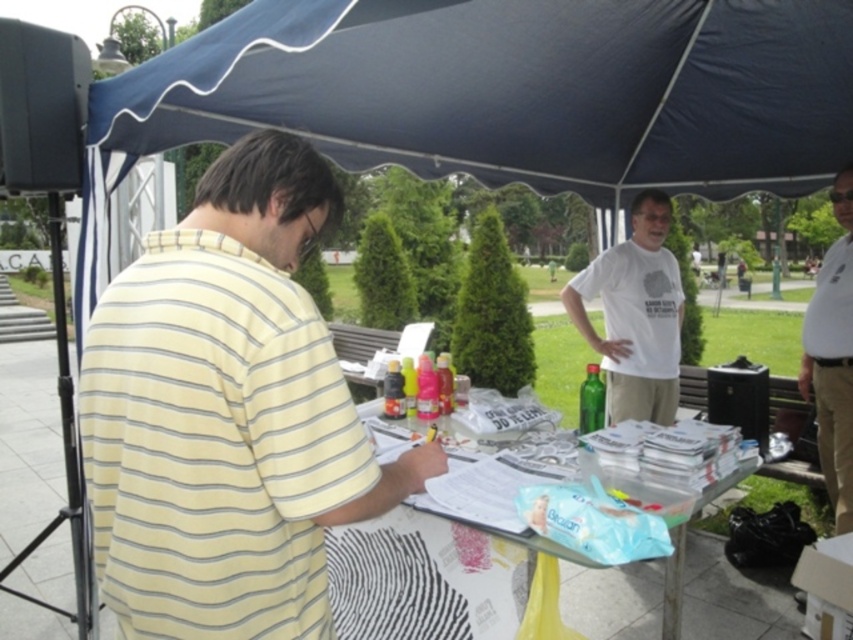
Find the location of a particular element. white plastic table at center is located at coordinates (432, 577).

Is white plastic table at center further to camera compared to white cotton shirt at upper center?

That is False.

Who is more forward, (595, 577) or (820, 438)?

Point (820, 438)

You are a GUI agent. You are given a task and a screenshot of the screen. Output one action in this format:
    pyautogui.click(x=<x>, y=<y>)
    Task: Click on the white plastic table at center
    
    Given the screenshot: What is the action you would take?
    pyautogui.click(x=432, y=577)

Which is more to the left, white plastic table at center or white cotton t-shirt at center?

Answer: white plastic table at center is more to the left.

Between white plastic table at center and white cotton t-shirt at center, which one has less height?

white plastic table at center is shorter.

Is point (357, 560) positioned in front of point (596, 278)?

Yes.

Image resolution: width=853 pixels, height=640 pixels. In order to click on white plastic table at center in this screenshot , I will do `click(432, 577)`.

Does white cotton t-shirt at center appear under white cotton polo shirt at right?

No, white cotton t-shirt at center is not below white cotton polo shirt at right.

Is point (650, 323) closer to viewer compared to point (817, 339)?

No, it is behind (817, 339).

Identify the location of white cotton t-shirt at center. (635, 314).